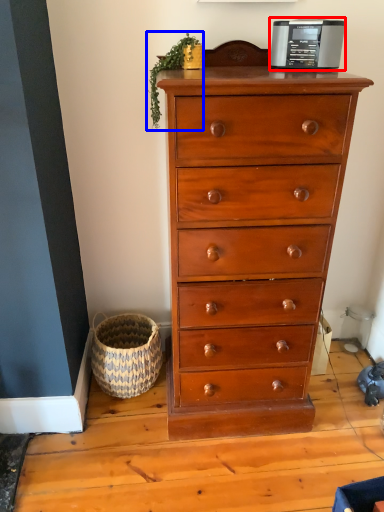
Question: Which point is closer to the camera, appliance (highlighted by a red box) or plant (highlighted by a blue box)?

Choices:
 (A) appliance
 (B) plant

Answer: (A)